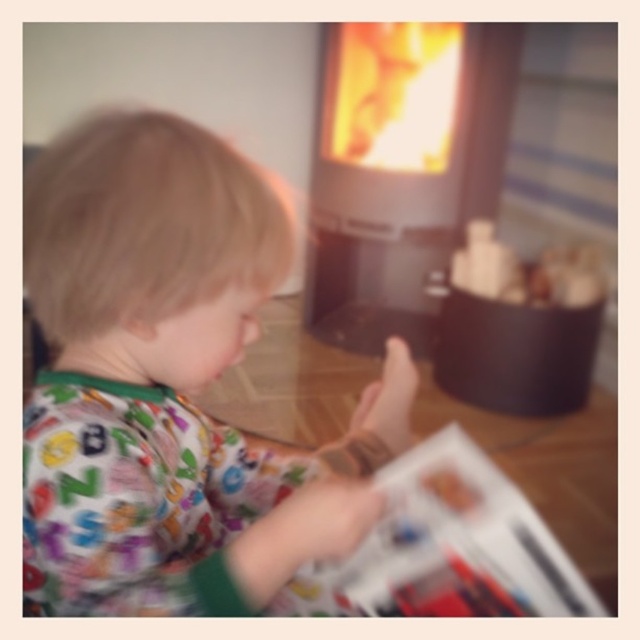
Question: Which point is farther to the camera?

Choices:
 (A) matte black fireplace at center
 (B) printed paper magazine at lower center

Answer: (A)

Question: Which point appears closest to the camera in this image?

Choices:
 (A) (458, 605)
 (B) (490, 180)
 (C) (134, 189)

Answer: (C)

Question: Does printed fabric shirt at center come behind printed paper magazine at lower center?

Choices:
 (A) yes
 (B) no

Answer: (B)

Question: From the image, what is the correct spatial relationship of printed fabric shirt at center in relation to printed paper magazine at lower center?

Choices:
 (A) left
 (B) right

Answer: (A)

Question: Which object is positioned closest to the printed paper magazine at lower center?

Choices:
 (A) matte black fireplace at center
 (B) printed fabric shirt at center

Answer: (B)

Question: Can you confirm if printed fabric shirt at center is positioned below matte black fireplace at center?

Choices:
 (A) no
 (B) yes

Answer: (B)